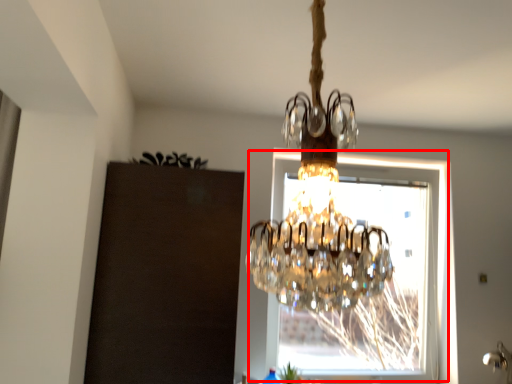
Question: From the image, what is the correct spatial relationship of window (annotated by the red box) in relation to plant?

Choices:
 (A) right
 (B) left

Answer: (A)